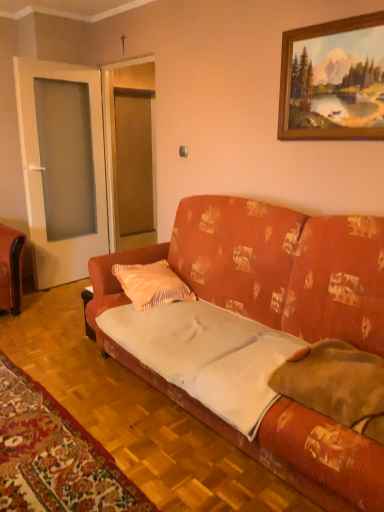
Find the location of a particular element. vacant region above wooden picture frame at upper right (from a real-world perspective) is located at coordinates (339, 15).